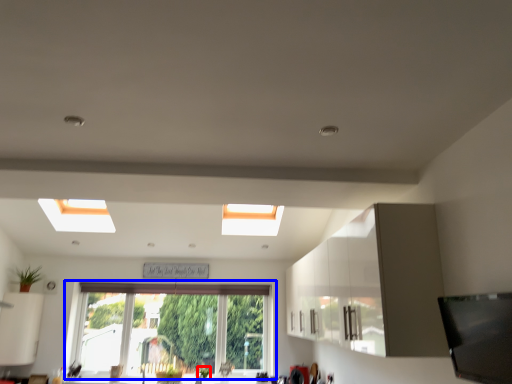
Question: Which point is closer to the camera, plant (highlighted by a red box) or window (highlighted by a blue box)?

Choices:
 (A) plant
 (B) window

Answer: (A)